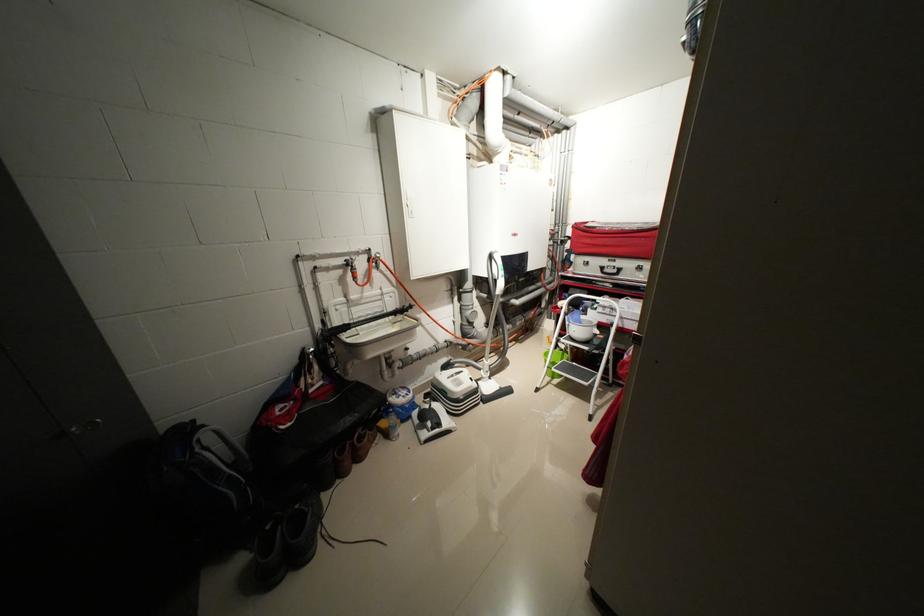
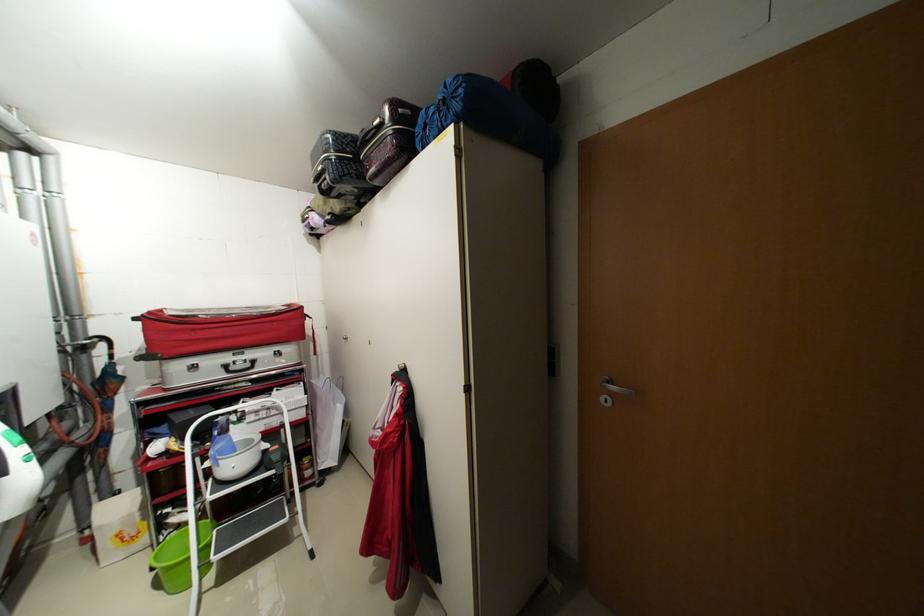
Question: The camera is either moving clockwise (left) or counter-clockwise (right) around the object. The first image is from the beginning of the video and the second image is from the end. Is the camera moving left or right when shooting the video?

Choices:
 (A) Left
 (B) Right

Answer: (A)